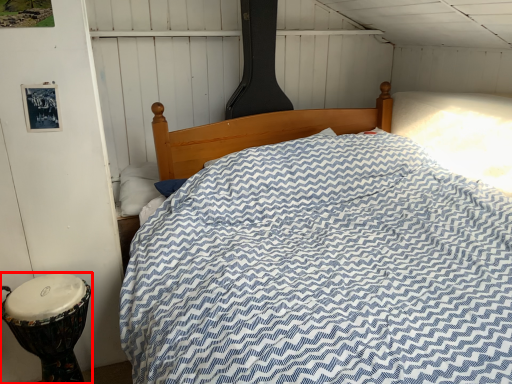
Question: From the image's perspective, what is the correct spatial positioning of drum (annotated by the red box) in reference to pillow?

Choices:
 (A) above
 (B) below

Answer: (B)